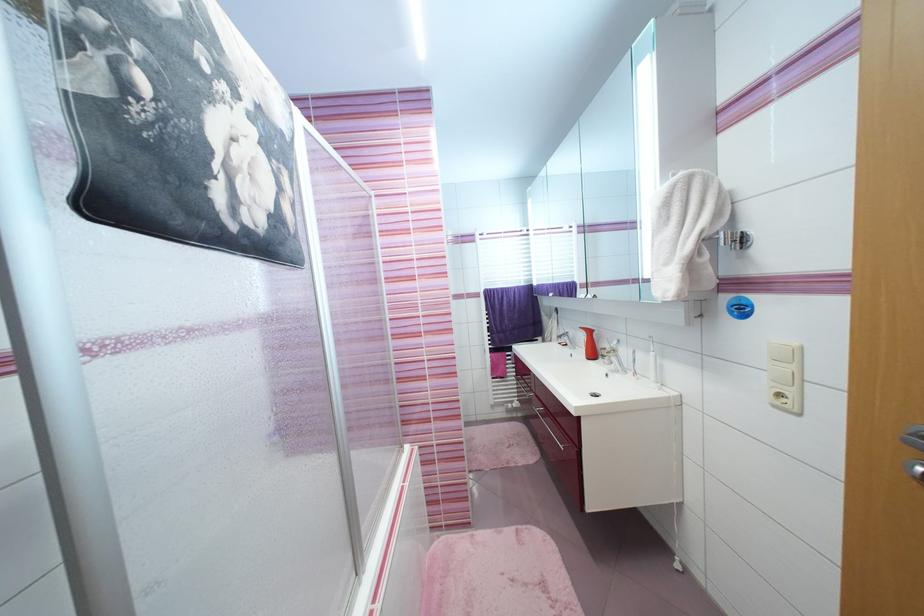
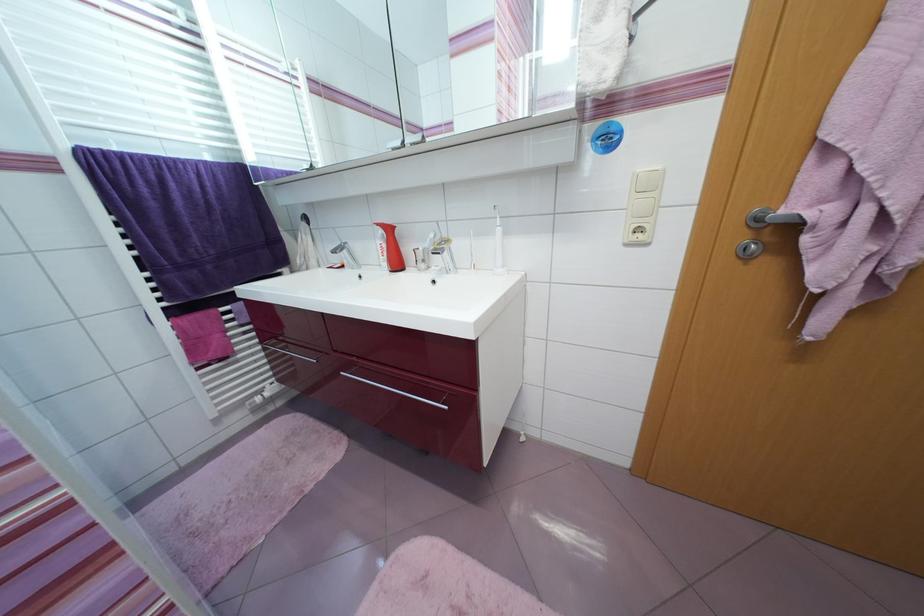
Question: The camera is either moving clockwise (left) or counter-clockwise (right) around the object. The first image is from the beginning of the video and the second image is from the end. Is the camera moving left or right when shooting the video?

Choices:
 (A) Left
 (B) Right

Answer: (A)